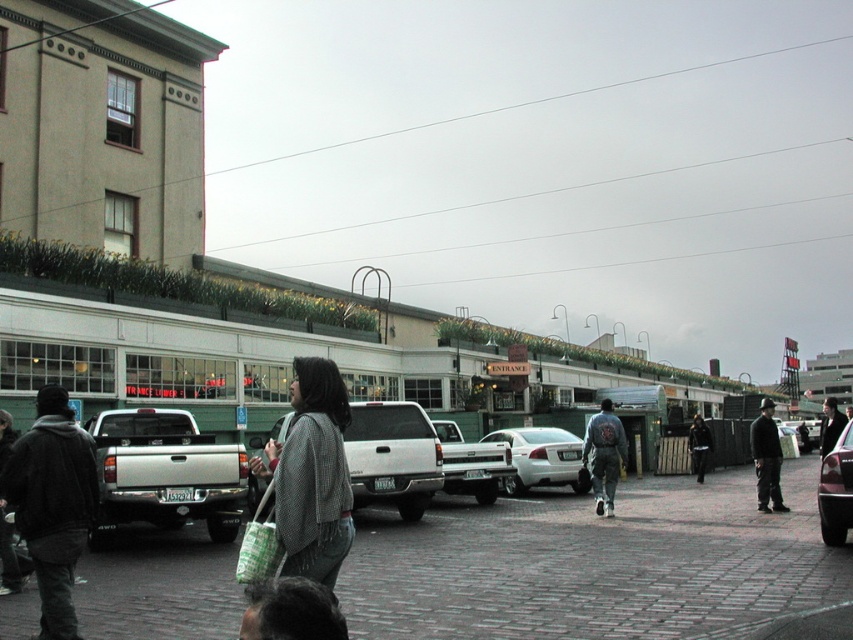
Question: Is dark gray fabric jacket at center wider than dark gray jacket at center?

Choices:
 (A) yes
 (B) no

Answer: (B)

Question: Which point is closer to the camera?

Choices:
 (A) matte white pickup truck at center
 (B) silver metallic truck at center

Answer: (A)

Question: Estimate the real-world distances between objects in this image. Which object is closer to the black leather jacket at center?

Choices:
 (A) dark gray jacket at center
 (B) black fleece jacket at left

Answer: (A)

Question: Does silver metallic pickup truck at lower left lie behind dark gray fabric jacket at center?

Choices:
 (A) yes
 (B) no

Answer: (B)

Question: Which point is closer to the camera?

Choices:
 (A) (763, 440)
 (B) (570, 451)
 (C) (222, 509)

Answer: (C)

Question: Can you confirm if shiny black car at center is thinner than dark gray fabric jacket at center?

Choices:
 (A) yes
 (B) no

Answer: (A)